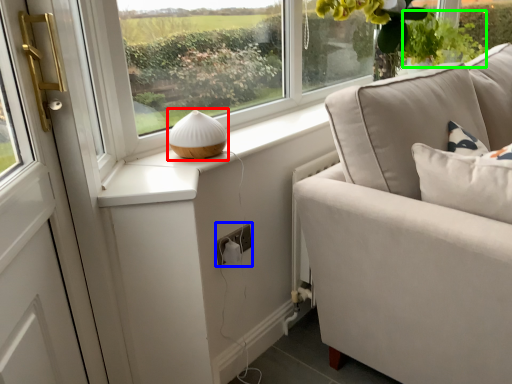
Question: Based on their relative distances, which object is nearer to table lamp (highlighted by a red box)? Choose from electric outlet (highlighted by a blue box) and plant (highlighted by a green box).

Choices:
 (A) electric outlet
 (B) plant

Answer: (A)